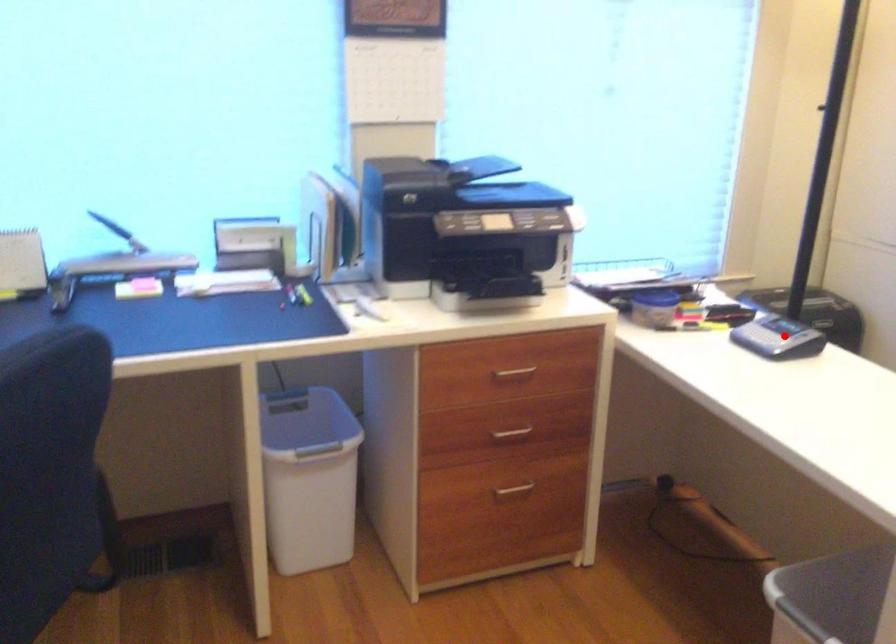
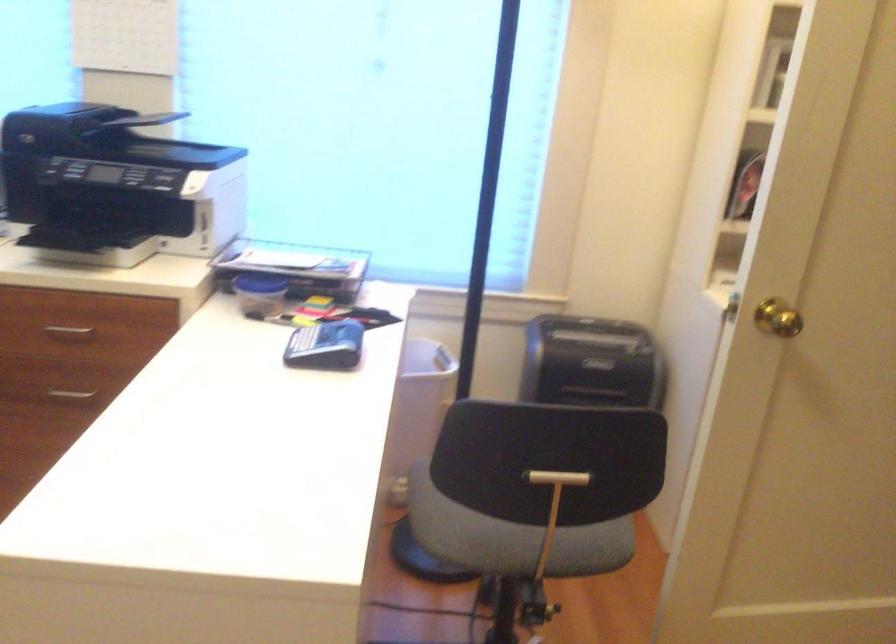
In the second image, find the point that corresponds to the highlighted location in the first image.

(325, 346)